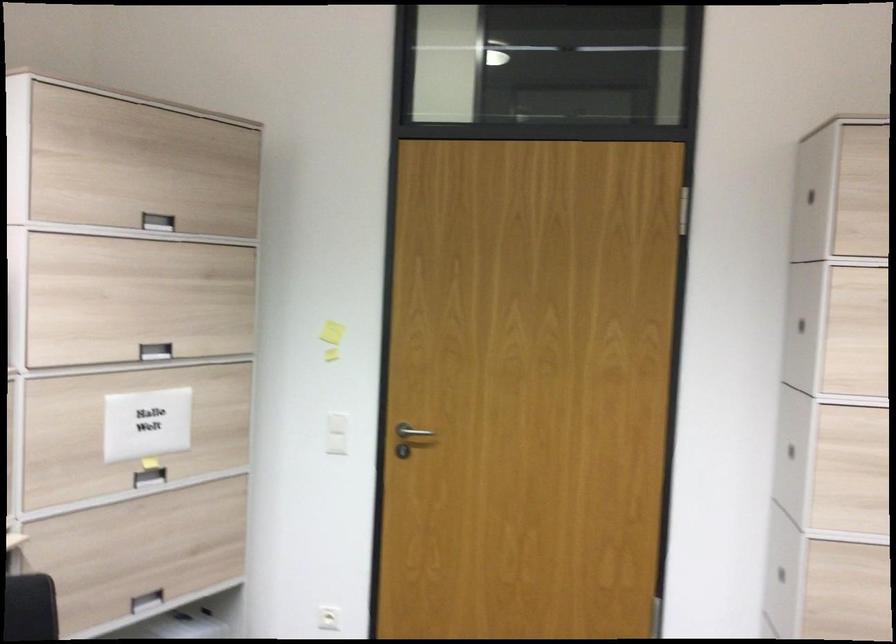
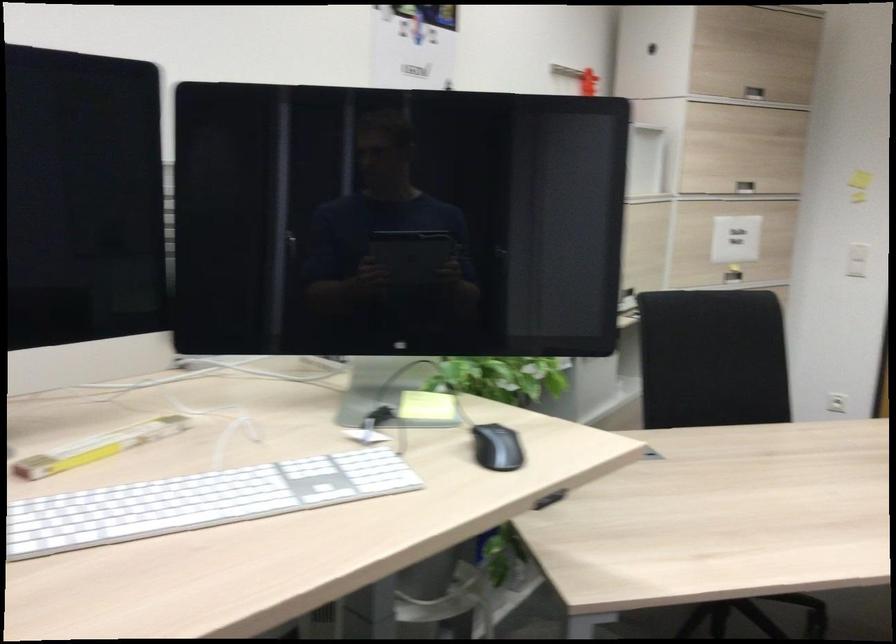
Find the pixel in the second image that matches (126,478) in the first image.

(733, 275)